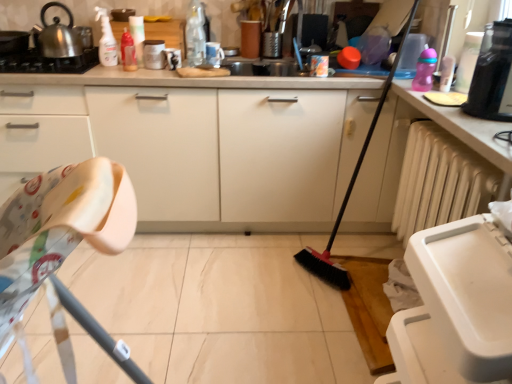
Question: Should I look upward or downward to see white plastic folding chair at left?

Choices:
 (A) up
 (B) down

Answer: (B)

Question: Considering the relative sizes of white plastic radiator at lower right and metallic stainless steel kettle at upper left in the image provided, is white plastic radiator at lower right wider than metallic stainless steel kettle at upper left?

Choices:
 (A) yes
 (B) no

Answer: (B)

Question: Can you confirm if white plastic radiator at lower right is taller than metallic stainless steel kettle at upper left?

Choices:
 (A) yes
 (B) no

Answer: (A)

Question: Is metallic stainless steel kettle at upper left located within white plastic radiator at lower right?

Choices:
 (A) yes
 (B) no

Answer: (B)

Question: From the image's perspective, is white plastic radiator at lower right below metallic stainless steel kettle at upper left?

Choices:
 (A) no
 (B) yes

Answer: (B)

Question: Is white plastic radiator at lower right to the left of metallic stainless steel kettle at upper left from the viewer's perspective?

Choices:
 (A) no
 (B) yes

Answer: (A)

Question: Is white plastic radiator at lower right aimed at metallic stainless steel kettle at upper left?

Choices:
 (A) no
 (B) yes

Answer: (B)

Question: Can you confirm if transparent glass bottle at upper center, arranged as the third bottle when viewed from the left, is smaller than translucent plastic bottle at upper center, which is counted as the 1th bottle, starting from the left?

Choices:
 (A) no
 (B) yes

Answer: (A)

Question: Is transparent glass bottle at upper center, which is the first bottle from right to left, not close to translucent plastic bottle at upper center, which is counted as the 1th bottle, starting from the left?

Choices:
 (A) no
 (B) yes

Answer: (A)

Question: Considering the relative sizes of transparent glass bottle at upper center, which is the first bottle from right to left, and translucent plastic bottle at upper center, which is counted as the 3th bottle, starting from the right, in the image provided, is transparent glass bottle at upper center, which is the first bottle from right to left, wider than translucent plastic bottle at upper center, which is counted as the 3th bottle, starting from the right,?

Choices:
 (A) no
 (B) yes

Answer: (B)

Question: Could you tell me if transparent glass bottle at upper center, which is the first bottle from right to left, is facing translucent plastic bottle at upper center, which is counted as the 3th bottle, starting from the right?

Choices:
 (A) yes
 (B) no

Answer: (B)

Question: From a real-world perspective, does transparent glass bottle at upper center, which is the first bottle from right to left, sit lower than translucent plastic bottle at upper center, which is counted as the 3th bottle, starting from the right?

Choices:
 (A) no
 (B) yes

Answer: (A)

Question: Can you confirm if transparent glass bottle at upper center, arranged as the third bottle when viewed from the left, is thinner than translucent plastic bottle at upper center, which is counted as the 1th bottle, starting from the left?

Choices:
 (A) yes
 (B) no

Answer: (B)

Question: Does translucent plastic bottle at upper center, which is counted as the 1th bottle, starting from the left, have a lesser height compared to matte white mug at upper center, which is the second appliance in left-to-right order?

Choices:
 (A) no
 (B) yes

Answer: (A)